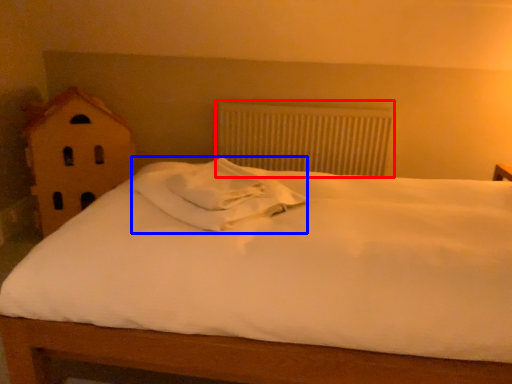
Question: Among these objects, which one is nearest to the camera, radiator (highlighted by a red box) or pillow (highlighted by a blue box)?

Choices:
 (A) radiator
 (B) pillow

Answer: (B)